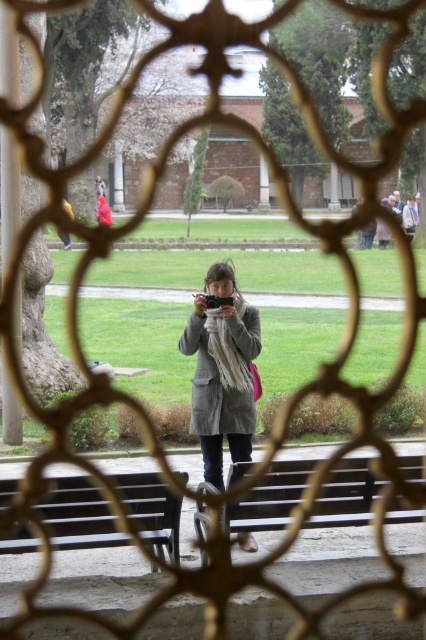
Question: Considering the relative positions of wooden bench at center and dark brown wooden bench at lower left in the image provided, where is wooden bench at center located with respect to dark brown wooden bench at lower left?

Choices:
 (A) left
 (B) right

Answer: (B)

Question: From the image, what is the correct spatial relationship of matte gray coat at center in relation to knitted beige scarf at center?

Choices:
 (A) right
 (B) left

Answer: (B)

Question: Does wooden bench at center come in front of knitted beige scarf at center?

Choices:
 (A) yes
 (B) no

Answer: (A)

Question: Considering the real-world distances, which object is closest to the wooden bench at center?

Choices:
 (A) knitted beige scarf at center
 (B) matte gray coat at center

Answer: (B)

Question: Which object is the farthest from the wooden bench at center?

Choices:
 (A) matte gray coat at center
 (B) knitted beige scarf at center

Answer: (B)

Question: Which of the following is the farthest from the observer?

Choices:
 (A) knitted beige scarf at center
 (B) matte gray coat at center

Answer: (A)